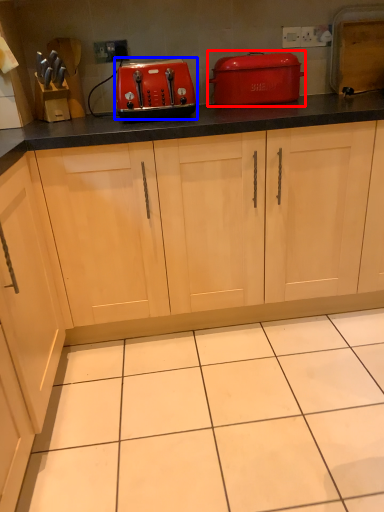
Question: Which point is further to the camera, home appliance (highlighted by a red box) or kitchen appliance (highlighted by a blue box)?

Choices:
 (A) home appliance
 (B) kitchen appliance

Answer: (A)